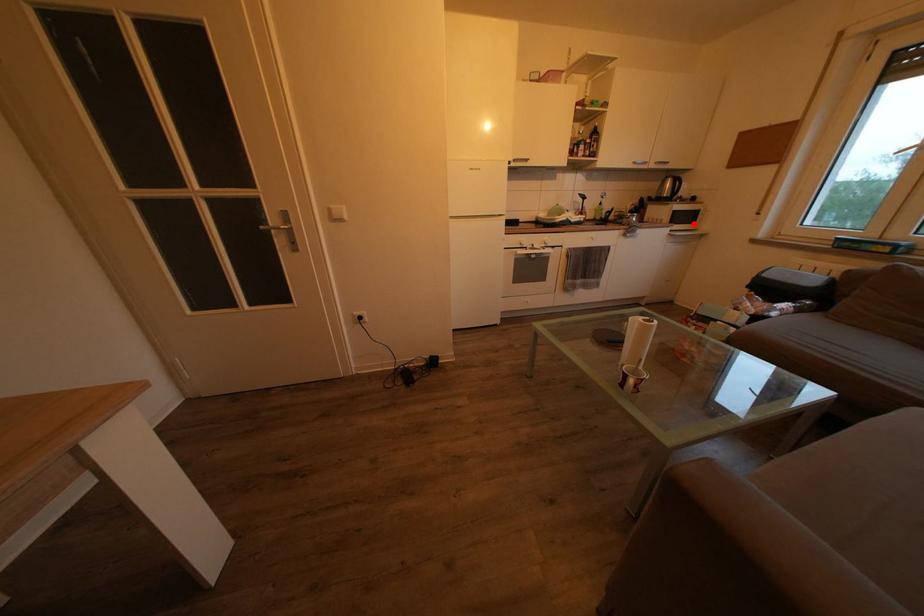
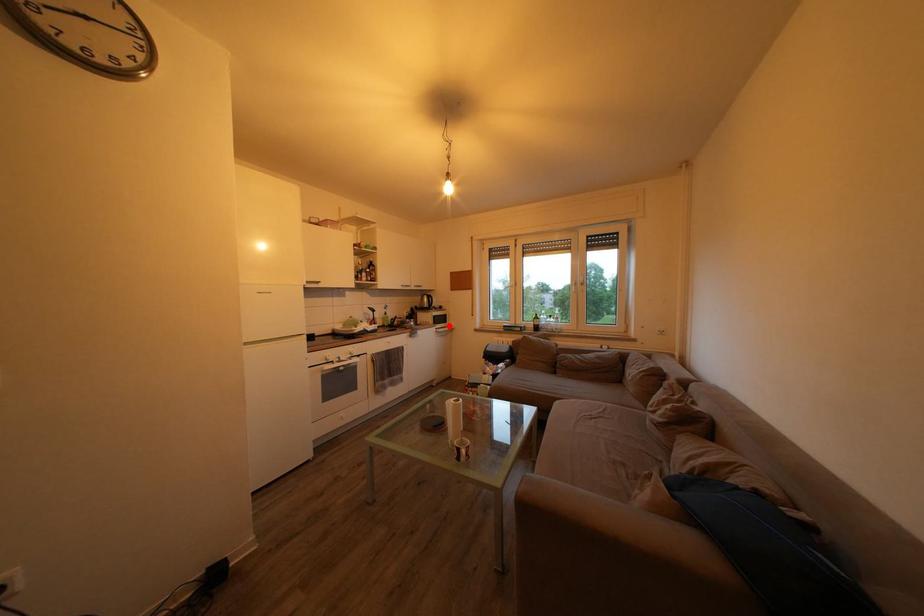
I am providing you with two images of the same scene from different viewpoints. A red point is marked on the first image and another point is marked on the second image. Are the points marked in image1 and image2 representing the same 3D position?

Yes